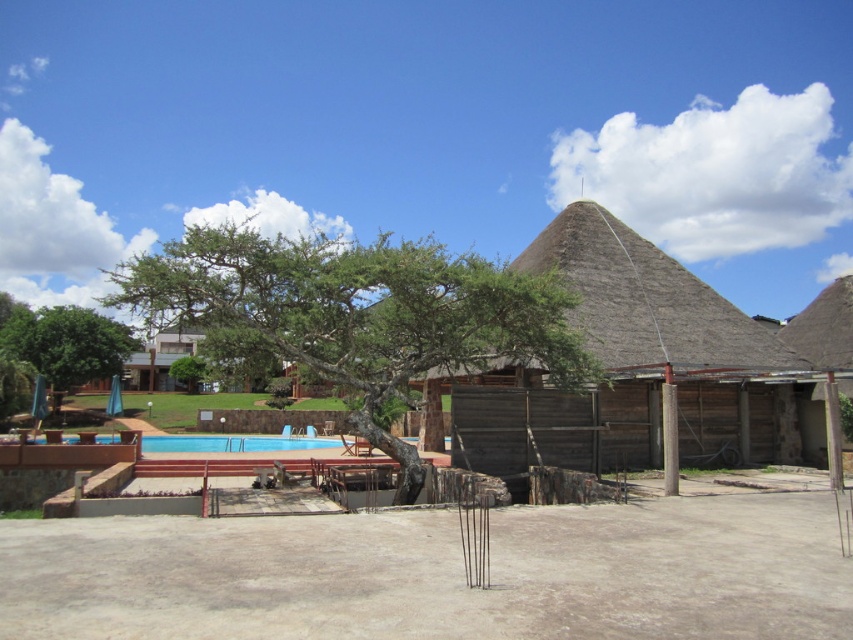
Is point (144, 275) farther from viewer compared to point (677, 369)?

No, (144, 275) is closer to viewer.

How distant is green leafy tree at center from thatched wood hut at center?

A distance of 5.66 meters exists between green leafy tree at center and thatched wood hut at center.

Does point (334, 333) come in front of point (630, 259)?

Yes, point (334, 333) is closer to viewer.

At what (x,y) coordinates should I click in order to perform the action: click on green leafy tree at center. Please return your answer as a coordinate pair (x, y). The width and height of the screenshot is (853, 640). Looking at the image, I should click on (354, 314).

Does thatched wood hut at center have a greater width compared to thatched straw roof at upper right?

Indeed, thatched wood hut at center has a greater width compared to thatched straw roof at upper right.

Between point (682, 353) and point (843, 321), which one is positioned in front?

Point (682, 353) is in front.

Is point (621, 230) positioned after point (838, 282)?

No, (621, 230) is closer to viewer.

At what (x,y) coordinates should I click in order to perform the action: click on thatched wood hut at center. Please return your answer as a coordinate pair (x, y). This screenshot has height=640, width=853. Looking at the image, I should click on (666, 348).

Looking at this image, who is shorter, green leafy tree at center or thatched straw roof at upper right?

thatched straw roof at upper right

Is point (564, 385) less distant than point (836, 337)?

Yes, it is in front of point (836, 337).

Identify the location of green leafy tree at center. (354, 314).